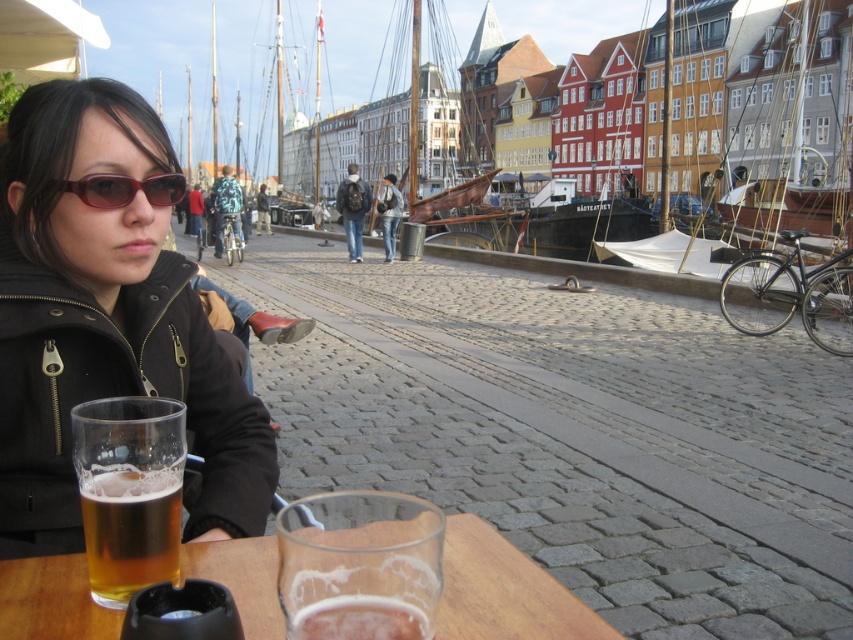
Question: Does golden matte glass at lower left have a larger size compared to foamy amber beer at lower center?

Choices:
 (A) no
 (B) yes

Answer: (B)

Question: Does golden matte glass at lower left appear on the right side of matte red sunglasses at upper left?

Choices:
 (A) yes
 (B) no

Answer: (A)

Question: Which point is closer to the camera?

Choices:
 (A) (136, 221)
 (B) (368, 634)

Answer: (B)

Question: Can you confirm if matte black jacket at lower left is positioned above matte red sunglasses at upper left?

Choices:
 (A) yes
 (B) no

Answer: (B)

Question: Among these objects, which one is nearest to the camera?

Choices:
 (A) matte red sunglasses at upper left
 (B) golden matte glass at lower left
 (C) matte black jacket at lower left

Answer: (B)

Question: Based on their relative distances, which object is nearer to the foamy amber beer at lower center?

Choices:
 (A) matte black jacket at lower left
 (B) clear glass table at center
 (C) golden matte glass at lower left
 (D) matte red sunglasses at upper left

Answer: (B)